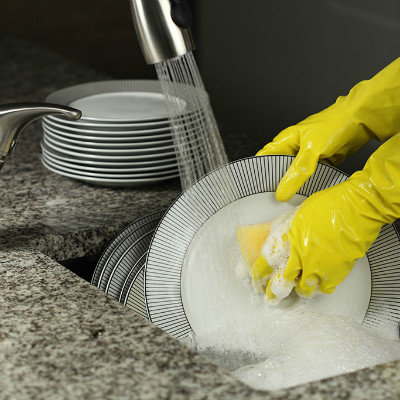
Where is `basin`? The width and height of the screenshot is (400, 400). basin is located at coordinates (82, 265).